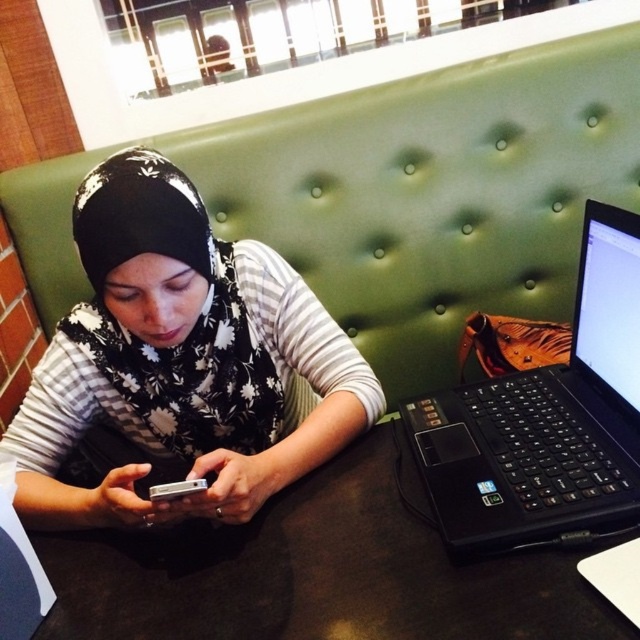
Question: Which point is closer to the camera taking this photo?

Choices:
 (A) (632, 353)
 (B) (390, 556)
 (C) (349, 346)
 (D) (173, 499)

Answer: (B)

Question: Does black matte table at center have a greater width compared to black matte laptop at right?

Choices:
 (A) no
 (B) yes

Answer: (B)

Question: Which object is positioned closest to the silver metallic smartphone at center?

Choices:
 (A) black floral hijab at center
 (B) black matte laptop at right
 (C) black matte table at center

Answer: (C)

Question: Considering the real-world distances, which object is closest to the silver metallic smartphone at center?

Choices:
 (A) black matte laptop at right
 (B) black matte table at center
 (C) black floral hijab at center

Answer: (B)

Question: Can you confirm if black matte table at center is thinner than silver metallic smartphone at center?

Choices:
 (A) no
 (B) yes

Answer: (A)

Question: Is black matte table at center thinner than silver metallic smartphone at center?

Choices:
 (A) no
 (B) yes

Answer: (A)